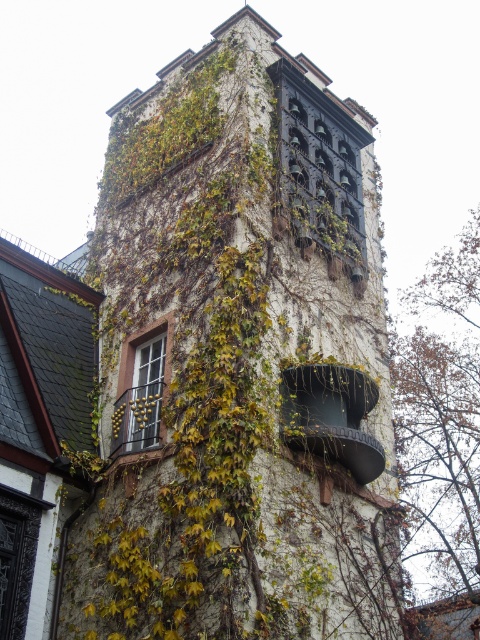
Does brown bark tree at right have a lesser height compared to matte glass window at center-left?

No, brown bark tree at right is not shorter than matte glass window at center-left.

Who is more distant from viewer, (457, 536) or (149, 385)?

The point (457, 536) is behind.

The image size is (480, 640). Identify the location of brown bark tree at right. click(439, 467).